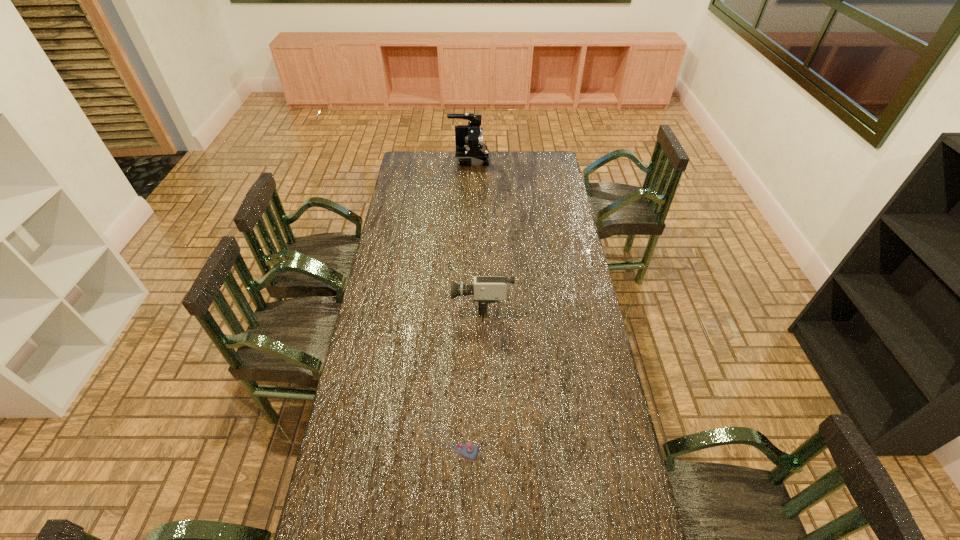
Identify the location of vacant area situated on the back of the nearest object. (454, 406).

At what (x,y) coordinates should I click in order to perform the action: click on object that is at the far edge. Please return your answer as a coordinate pair (x, y). Image resolution: width=960 pixels, height=540 pixels. Looking at the image, I should click on (470, 150).

Identify the location of vacant space at the far edge of the desktop. This screenshot has width=960, height=540. (446, 152).

Locate an element on the screen. vacant region at the left edge of the desktop is located at coordinates (419, 230).

The height and width of the screenshot is (540, 960). I want to click on blank space at the right edge, so click(576, 403).

In order to click on vacant space at the far left corner of the desktop in this screenshot , I will do `click(425, 166)`.

In order to click on empty space between the second tallest object and the joystick in this screenshot , I will do `click(468, 373)`.

This screenshot has height=540, width=960. I want to click on empty space between the shortest object and the second tallest object, so click(x=468, y=373).

In order to click on object that is the second closest to the joystick in this screenshot , I will do `click(470, 150)`.

Where is `object that is the nearest to the farthest object`? The image size is (960, 540). object that is the nearest to the farthest object is located at coordinates (487, 289).